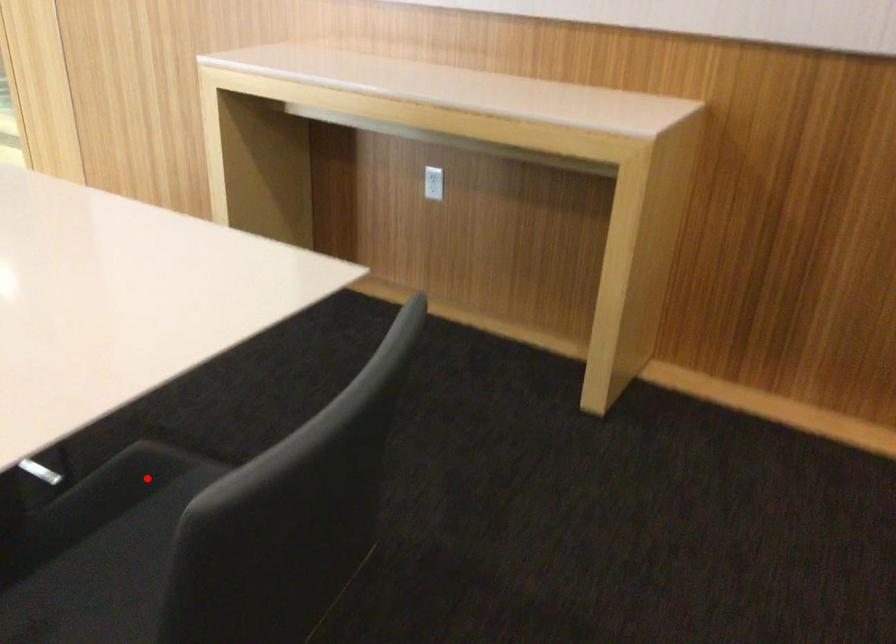
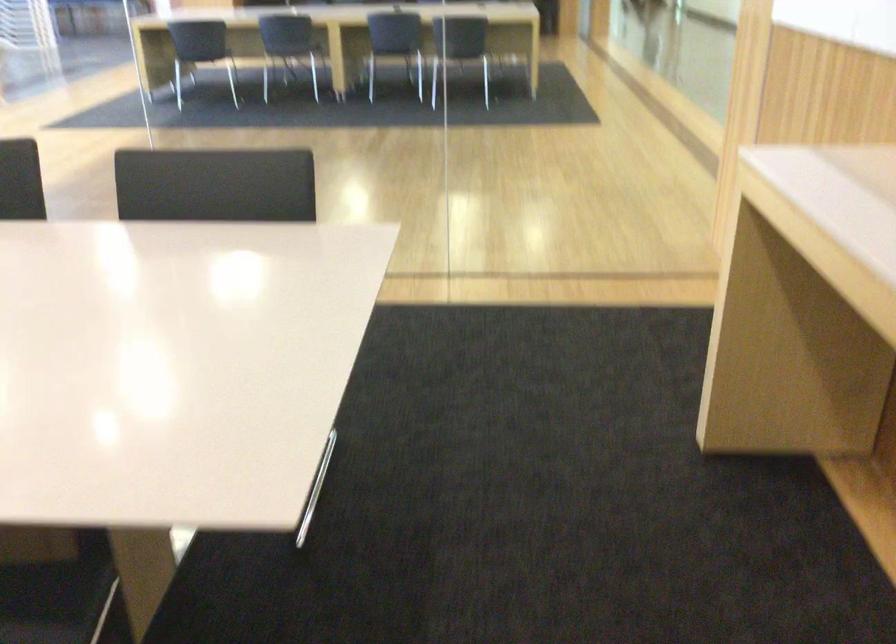
In the second image, find the point that corresponds to the highlighted location in the first image.

(55, 601)